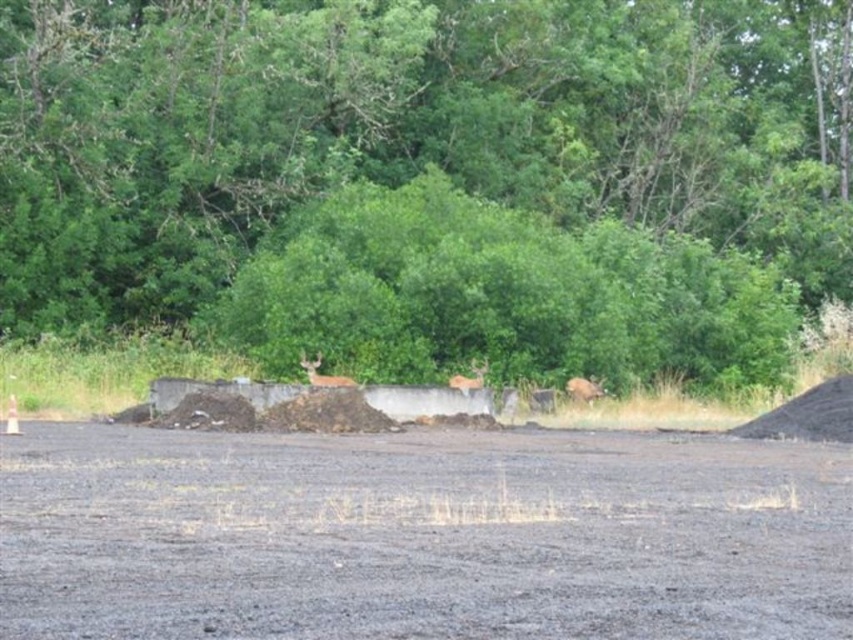
Question: Is brown furry deer at center-right above brown matte/deer at center?

Choices:
 (A) no
 (B) yes

Answer: (A)

Question: Does gray gravel dirt track at center have a greater width compared to brown matte/deer at center?

Choices:
 (A) yes
 (B) no

Answer: (A)

Question: Among these objects, which one is farthest from the camera?

Choices:
 (A) brown fur deer at center
 (B) brown matte/deer at center
 (C) brown furry deer at center-right
 (D) gray gravel dirt track at center

Answer: (C)

Question: Among these points, which one is nearest to the camera?

Choices:
 (A) (463, 392)
 (B) (596, 168)
 (C) (521, 618)
 (D) (595, 397)

Answer: (C)

Question: Estimate the real-world distances between objects in this image. Which object is closer to the gray gravel dirt track at center?

Choices:
 (A) green leafy tree at center
 (B) brown fur deer at center

Answer: (B)

Question: Is brown fur deer at center bigger than brown furry deer at center-right?

Choices:
 (A) yes
 (B) no

Answer: (A)